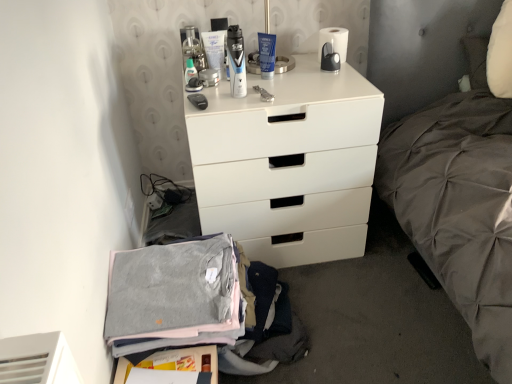
Where is `white matte toilet paper at upper center`? This screenshot has width=512, height=384. white matte toilet paper at upper center is located at coordinates [334, 41].

Measure the distance between white matte chest of drawers at center and camera.

The distance of white matte chest of drawers at center from camera is 4.03 feet.

In order to click on translucent plastic bottle at upper center in this screenshot , I will do `click(191, 72)`.

Which is less distant, (321, 75) or (129, 324)?

The point (129, 324) is closer to the camera.

How different are the orientations of white matte chest of drawers at center and gray cotton sweater at lower left in degrees?

The angular difference between white matte chest of drawers at center and gray cotton sweater at lower left is 88 degrees.

Is white matte chest of drawers at center facing away from gray cotton sweater at lower left?

white matte chest of drawers at center is not turned away from gray cotton sweater at lower left.

Is gray cotton sweater at lower left located within white matte chest of drawers at center?

No, white matte chest of drawers at center does not contain gray cotton sweater at lower left.

From a real-world perspective, is white matte toilet paper at upper center physically below translucent plastic bottle at upper center?

No, from a real-world perspective, white matte toilet paper at upper center is not under translucent plastic bottle at upper center.

Is white matte toilet paper at upper center aimed at translucent plastic bottle at upper center?

No, white matte toilet paper at upper center does not turn towards translucent plastic bottle at upper center.

Considering their positions, is white matte toilet paper at upper center located in front of or behind translucent plastic bottle at upper center?

white matte toilet paper at upper center is behind translucent plastic bottle at upper center.

Does white matte toilet paper at upper center have a larger size compared to translucent plastic bottle at upper center?

Correct, white matte toilet paper at upper center is larger in size than translucent plastic bottle at upper center.

From a real-world perspective, does gray cotton sweater at lower left sit lower than translucent plastic bottle at upper center?

Yes.

Can you confirm if gray cotton sweater at lower left is shorter than translucent plastic bottle at upper center?

No.

Is gray cotton sweater at lower left facing towards translucent plastic bottle at upper center?

No, gray cotton sweater at lower left is not turned towards translucent plastic bottle at upper center.

Find the location of a particular element. clothing to the right of translucent plastic bottle at upper center is located at coordinates (174, 296).

Is point (192, 70) behind point (348, 33)?

No.

Is translucent plastic bottle at upper center shorter than white matte toilet paper at upper center?

Yes.

Which of these two, translucent plastic bottle at upper center or white matte toilet paper at upper center, is wider?

white matte toilet paper at upper center is wider.

Considering the relative sizes of white matte chest of drawers at center and translucent plastic bottle at upper center in the image provided, is white matte chest of drawers at center shorter than translucent plastic bottle at upper center?

In fact, white matte chest of drawers at center may be taller than translucent plastic bottle at upper center.

Is point (358, 208) farther from viewer compared to point (189, 74)?

That is True.

Consider the image. Is the surface of white matte chest of drawers at center in direct contact with translucent plastic bottle at upper center?

No.

Between white matte chest of drawers at center and translucent plastic bottle at upper center, which one has larger size?

white matte chest of drawers at center.

Considering the relative positions of translucent plastic bottle at upper center and white matte chest of drawers at center in the image provided, is translucent plastic bottle at upper center to the left of white matte chest of drawers at center from the viewer's perspective?

Correct, you'll find translucent plastic bottle at upper center to the left of white matte chest of drawers at center.

From a real-world perspective, which object stands above the other?

From a 3D spatial view, translucent plastic bottle at upper center is above.

Is white matte chest of drawers at center a part of translucent plastic bottle at upper center?

No, white matte chest of drawers at center is not a part of translucent plastic bottle at upper center.

From the image's perspective, relative to white matte chest of drawers at center, is translucent plastic bottle at upper center above or below?

translucent plastic bottle at upper center is situated higher than white matte chest of drawers at center in the image.

Measure the distance between white matte toilet paper at upper center and white matte chest of drawers at center.

white matte toilet paper at upper center and white matte chest of drawers at center are 17.99 inches apart from each other.

Consider the image. Looking at their sizes, would you say white matte toilet paper at upper center is wider or thinner than white matte chest of drawers at center?

Considering their sizes, white matte toilet paper at upper center looks slimmer than white matte chest of drawers at center.

Is white matte toilet paper at upper center aimed at white matte chest of drawers at center?

No, white matte toilet paper at upper center is not aimed at white matte chest of drawers at center.

From the image's perspective, which one is positioned higher, white matte toilet paper at upper center or white matte chest of drawers at center?

white matte toilet paper at upper center is shown above in the image.

In the image, there is a gray cotton sweater at lower left. Identify the location of the chest of drawers above it (from the image's perspective). This screenshot has height=384, width=512. (289, 165).

This screenshot has width=512, height=384. What are the coordinates of `toilet paper above the translucent plastic bottle at upper center (from a real-world perspective)` in the screenshot? It's located at (334, 41).

Which object lies further to the anchor point gray cotton sweater at lower left, white matte chest of drawers at center or translucent plastic bottle at upper center?

Among the two, translucent plastic bottle at upper center is located further to gray cotton sweater at lower left.

From the image, which object appears to be nearer to white matte chest of drawers at center, gray cotton sweater at lower left or translucent plastic bottle at upper center?

Based on the image, gray cotton sweater at lower left appears to be nearer to white matte chest of drawers at center.

When comparing their distances from gray cotton sweater at lower left, does translucent plastic bottle at upper center or white matte chest of drawers at center seem further?

translucent plastic bottle at upper center is further to gray cotton sweater at lower left.

When comparing their distances from translucent plastic bottle at upper center, does white matte toilet paper at upper center or gray cotton sweater at lower left seem further?

Based on the image, gray cotton sweater at lower left appears to be further to translucent plastic bottle at upper center.

Considering their positions, is translucent plastic bottle at upper center positioned closer to white matte chest of drawers at center than white matte toilet paper at upper center?

Based on the image, white matte toilet paper at upper center appears to be nearer to white matte chest of drawers at center.

Estimate the real-world distances between objects in this image. Which object is further from white matte chest of drawers at center, white matte toilet paper at upper center or gray cotton sweater at lower left?

white matte toilet paper at upper center is positioned further to the anchor white matte chest of drawers at center.

When comparing their distances from gray cotton sweater at lower left, does white matte toilet paper at upper center or translucent plastic bottle at upper center seem closer?

translucent plastic bottle at upper center is positioned closer to the anchor gray cotton sweater at lower left.

Based on their spatial positions, is white matte toilet paper at upper center or white matte chest of drawers at center further from gray cotton sweater at lower left?

Based on the image, white matte toilet paper at upper center appears to be further to gray cotton sweater at lower left.

Identify the location of the chest of drawers that lies between translucent plastic bottle at upper center and gray cotton sweater at lower left from top to bottom. (289, 165).

Find the location of `chest of drawers between translucent plastic bottle at upper center and white matte toilet paper at upper center in the horizontal direction`. chest of drawers between translucent plastic bottle at upper center and white matte toilet paper at upper center in the horizontal direction is located at coordinates (289, 165).

Locate an element on the screen. the chest of drawers between white matte toilet paper at upper center and gray cotton sweater at lower left vertically is located at coordinates (289, 165).

Locate an element on the screen. toiletry between white matte toilet paper at upper center and gray cotton sweater at lower left from top to bottom is located at coordinates (191, 72).